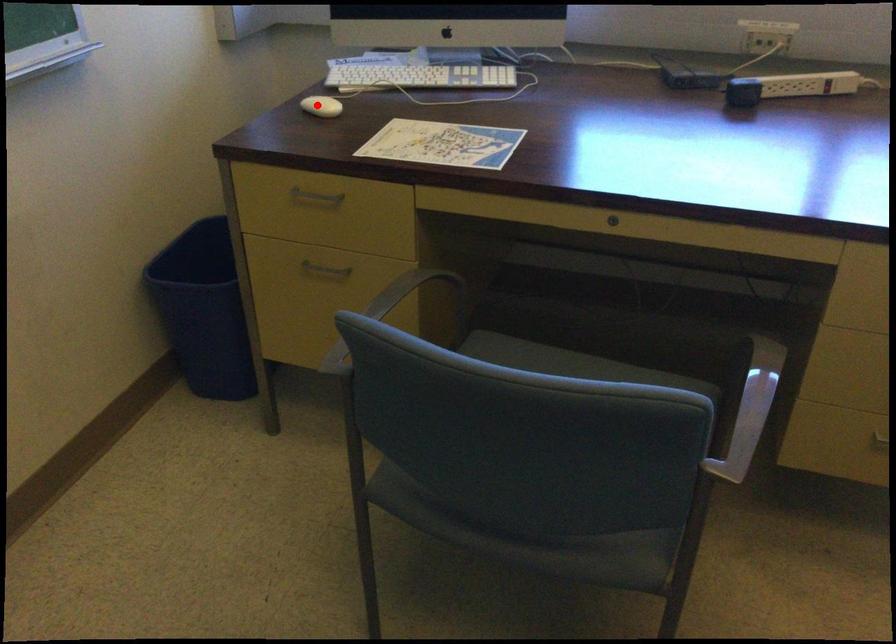
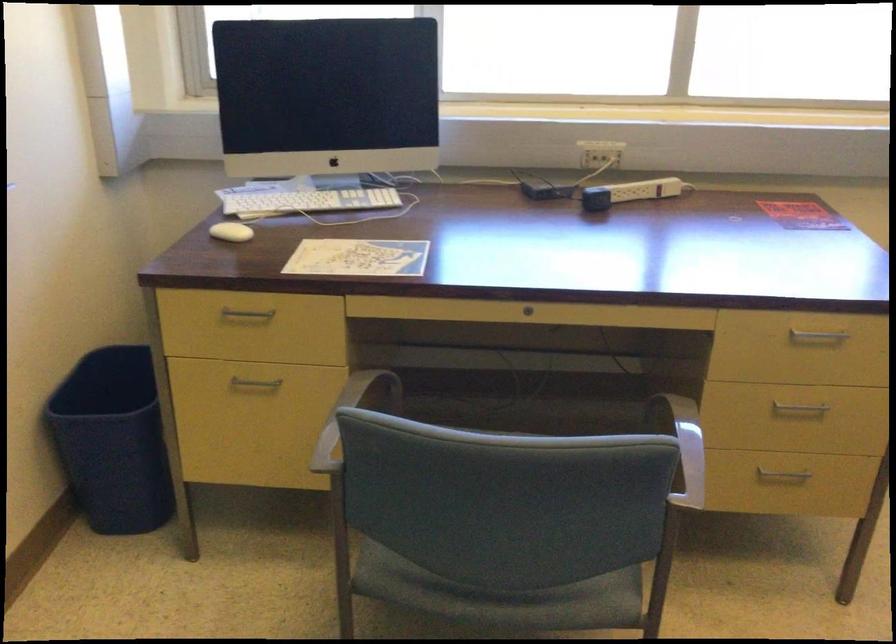
In the second image, find the point that corresponds to the highlighted location in the first image.

(230, 232)